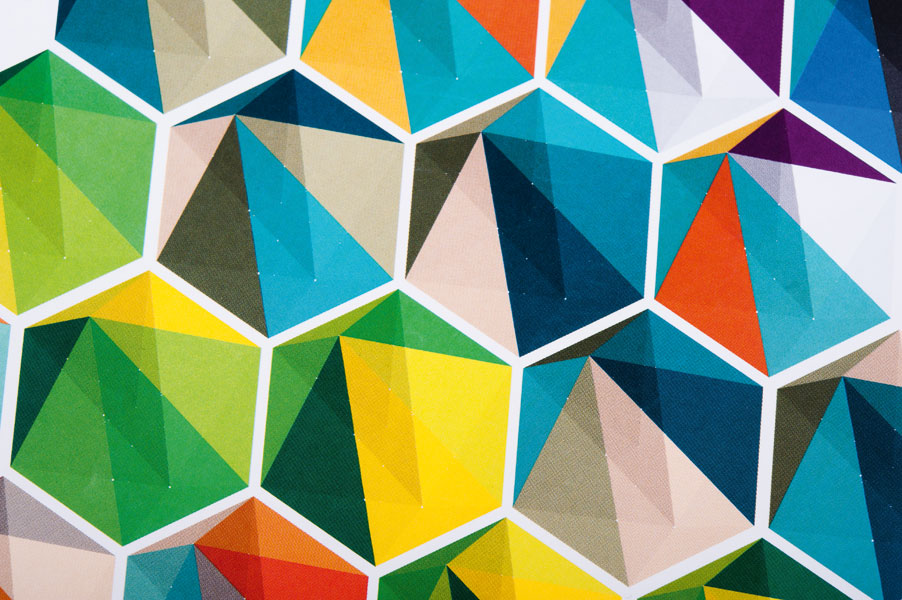
Locate an element on the screen. purple shade is located at coordinates (764, 151), (783, 155), (812, 137), (766, 32).